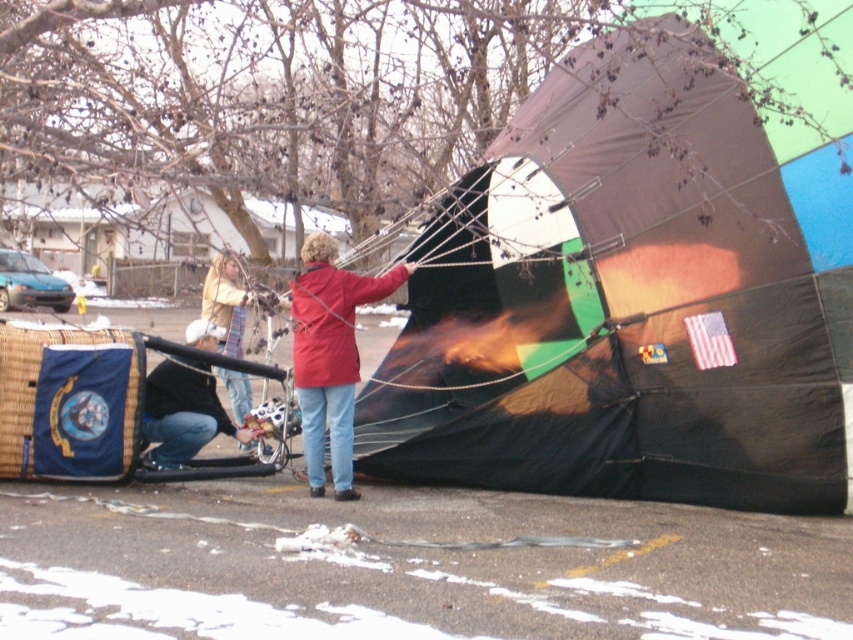
Who is taller, denim jeans at lower left or striped scarf at center?

With more height is striped scarf at center.

Which is behind, point (239, 433) or point (216, 260)?

Positioned behind is point (216, 260).

What do you see at coordinates (183, 413) in the screenshot? This screenshot has height=640, width=853. I see `denim jeans at lower left` at bounding box center [183, 413].

Locate an element on the screen. Image resolution: width=853 pixels, height=640 pixels. denim jeans at lower left is located at coordinates (183, 413).

Can you confirm if black matte parachute at center is positioned to the left of red matte jacket at center?

In fact, black matte parachute at center is to the right of red matte jacket at center.

Does black matte parachute at center appear on the right side of red matte jacket at center?

Yes, black matte parachute at center is to the right of red matte jacket at center.

The image size is (853, 640). Find the location of `black matte parachute at center`. black matte parachute at center is located at coordinates (637, 289).

Does black matte parachute at center have a smaller size compared to striped scarf at center?

No.

In the scene shown: Is black matte parachute at center to the left of striped scarf at center from the viewer's perspective?

Incorrect, black matte parachute at center is not on the left side of striped scarf at center.

You are a GUI agent. You are given a task and a screenshot of the screen. Output one action in this format:
    pyautogui.click(x=<x>, y=<y>)
    Task: Click on the black matte parachute at center
    Image resolution: width=853 pixels, height=640 pixels.
    Given the screenshot: What is the action you would take?
    pyautogui.click(x=637, y=289)

Locate an element on the screen. black matte parachute at center is located at coordinates pos(637,289).